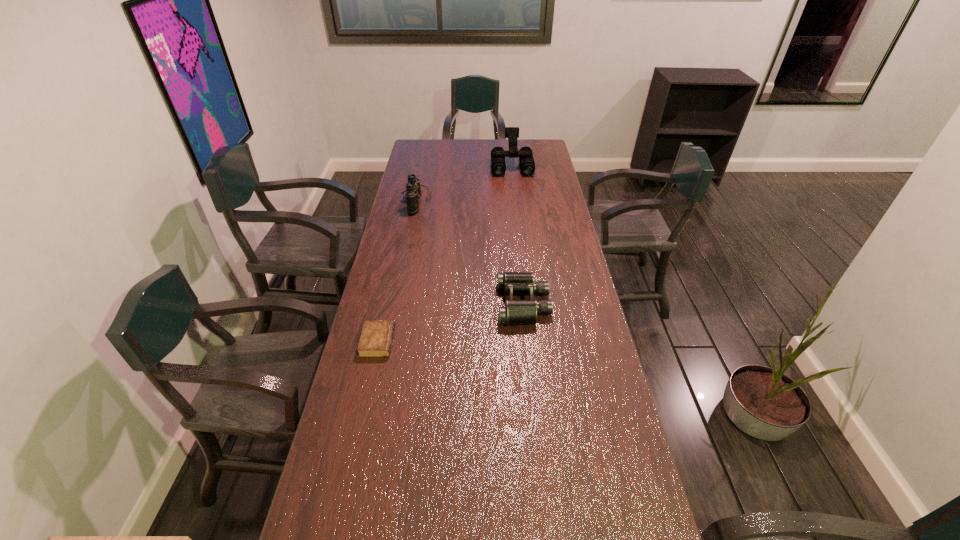
You are a GUI agent. You are given a task and a screenshot of the screen. Output one action in this format:
    pyautogui.click(x=<x>, y=<y>)
    Task: Click on the tallest binoculars
    The height and width of the screenshot is (540, 960).
    Given the screenshot: What is the action you would take?
    pyautogui.click(x=498, y=164)

The width and height of the screenshot is (960, 540). I want to click on the farthest binoculars, so click(x=498, y=164).

Locate an element on the screen. The height and width of the screenshot is (540, 960). the third shortest object is located at coordinates (413, 189).

The width and height of the screenshot is (960, 540). In order to click on the second farthest object in this screenshot , I will do `click(413, 189)`.

This screenshot has height=540, width=960. Identify the location of the second shortest object. (515, 312).

Identify the location of the nearest binoculars. (515, 312).

The height and width of the screenshot is (540, 960). In order to click on the shortest object in this screenshot , I will do click(376, 338).

Identify the location of vacant area situated 0.360m on the front lenses of the farthest object. The width and height of the screenshot is (960, 540). (517, 217).

Image resolution: width=960 pixels, height=540 pixels. Identify the location of free region located 0.390m on the back of the second farthest object. (426, 151).

The height and width of the screenshot is (540, 960). In order to click on vacant space located on the front-facing side of the shortest binoculars in this screenshot , I will do `click(444, 304)`.